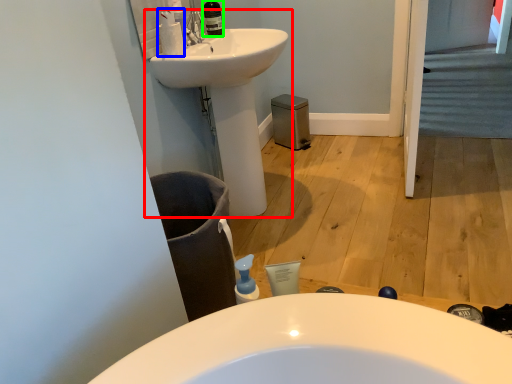
Question: Which object is the closest to the sink (highlighted by a red box)? Choose among these: cleaning product (highlighted by a blue box) or toiletry (highlighted by a green box).

Choices:
 (A) cleaning product
 (B) toiletry

Answer: (B)